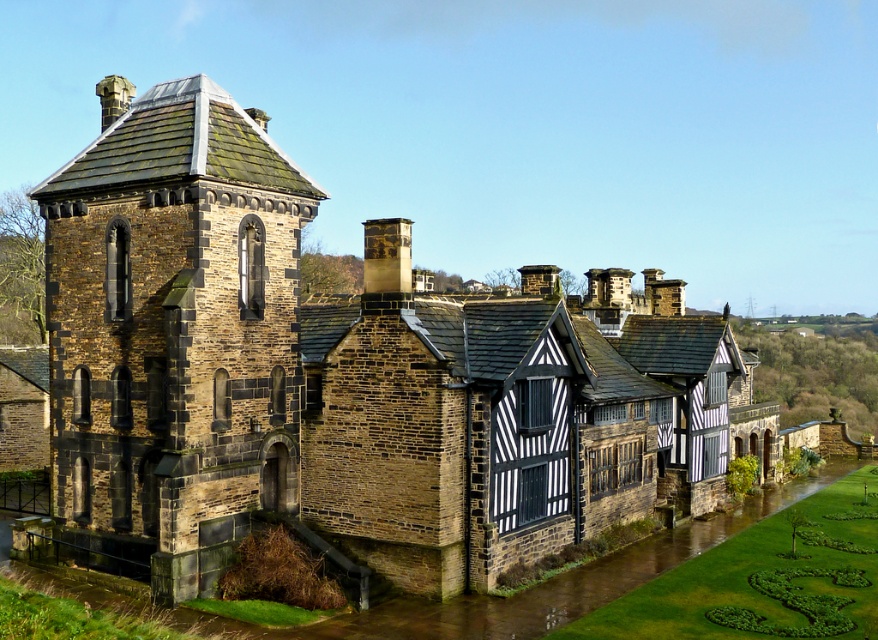
Locate an element on the screen. brown stone flood at lower left is located at coordinates (560, 580).

Can you confirm if brown stone flood at lower left is smaller than dark brown stone chimney at center?

Indeed, brown stone flood at lower left has a smaller size compared to dark brown stone chimney at center.

Where is `brown stone flood at lower left`? Image resolution: width=878 pixels, height=640 pixels. brown stone flood at lower left is located at coordinates (560, 580).

Is brown stone tower at left to the right of brown stone flood at lower left from the viewer's perspective?

Incorrect, brown stone tower at left is not on the right side of brown stone flood at lower left.

At what (x,y) coordinates should I click in order to perform the action: click on brown stone tower at left. Please return your answer as a coordinate pair (x, y). Looking at the image, I should click on (171, 333).

Can you confirm if brown stone tower at left is thinner than dark brown stone chimney at center?

No, brown stone tower at left is not thinner than dark brown stone chimney at center.

Is point (148, 296) positioned after point (375, 221)?

That is False.

Locate an element on the screen. The height and width of the screenshot is (640, 878). brown stone tower at left is located at coordinates (171, 333).